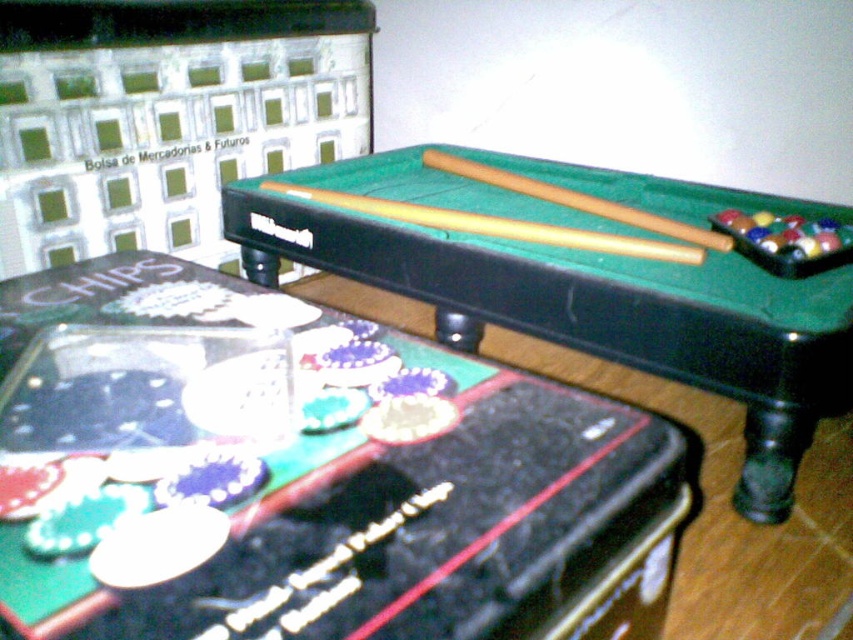
Is wooden cue at center thinner than wooden at center?

No, wooden cue at center is not thinner than wooden at center.

Is point (399, 216) closer to camera compared to point (538, 189)?

Yes.

Who is more forward, [607,241] or [669,225]?

Point [607,241] is more forward.

Where is `wooden cue at center`? This screenshot has height=640, width=853. wooden cue at center is located at coordinates [496, 225].

Who is higher up, green felt pool table at upper center or wooden cue at center?

wooden cue at center is higher up.

I want to click on green felt pool table at upper center, so [x=300, y=472].

Locate an element on the screen. This screenshot has height=640, width=853. green felt pool table at upper center is located at coordinates point(300,472).

Does green felt pool table at upper center appear over wooden at center?

Actually, green felt pool table at upper center is below wooden at center.

Can you confirm if green felt pool table at upper center is thinner than wooden at center?

No.

Who is more forward, (674, 499) or (664, 225)?

Positioned in front is point (674, 499).

Identify the location of green felt pool table at upper center. (300, 472).